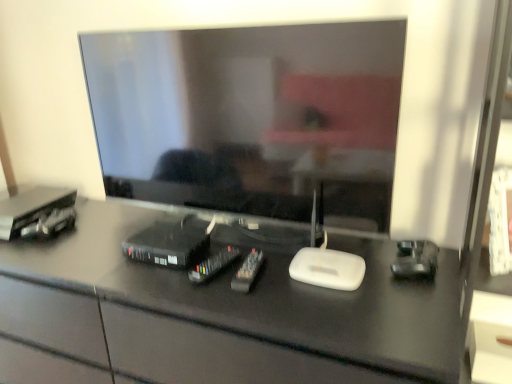
Identify the location of vacant space to the left of black plastic remote control at center, the 3th equipment in the left-to-right sequence. (156, 275).